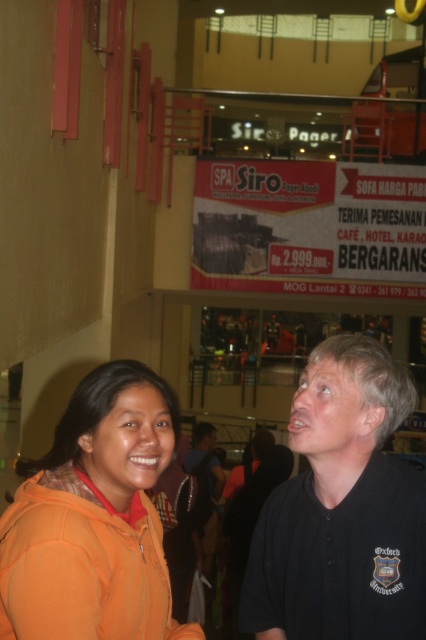
Question: Does orange fleece at center appear on the right side of orange fleece at lower left?

Choices:
 (A) no
 (B) yes

Answer: (B)

Question: Is orange fleece at center closer to the viewer compared to orange fleece at lower left?

Choices:
 (A) yes
 (B) no

Answer: (B)

Question: Which of these objects is positioned farthest from the orange fleece at lower left?

Choices:
 (A) black shirt at center
 (B) orange fleece at center

Answer: (A)

Question: Which point appears closest to the camera in this image?

Choices:
 (A) (420, 570)
 (B) (100, 465)
 (C) (319, 449)

Answer: (B)

Question: Estimate the real-world distances between objects in this image. Which object is closer to the black shirt at center?

Choices:
 (A) orange fleece at lower left
 (B) orange fleece at center

Answer: (B)

Question: Does orange fleece at center appear on the right side of black shirt at center?

Choices:
 (A) no
 (B) yes

Answer: (B)